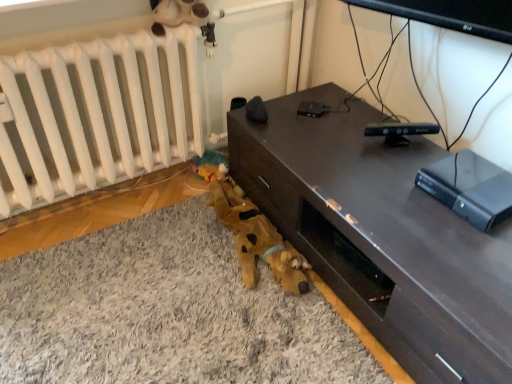
Locate an element on the screen. This screenshot has width=512, height=384. free area behind black plastic remote control at upper center, arranged as the 2th gadget when viewed from the left is located at coordinates (376, 115).